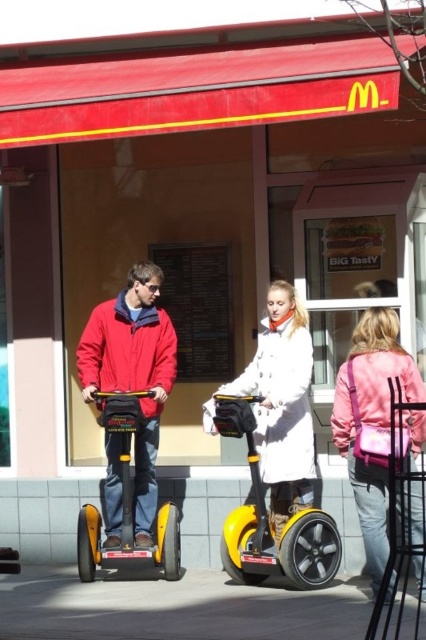
Question: Which point is farther to the camera?

Choices:
 (A) (92, 332)
 (B) (310, 355)

Answer: (A)

Question: Which of the following is the closest to the observer?

Choices:
 (A) (282, 472)
 (B) (319, 518)
 (C) (143, 362)

Answer: (B)

Question: Can you confirm if matte red jacket at center is smaller than yellow matte scooter at center?

Choices:
 (A) no
 (B) yes

Answer: (B)

Question: Does matte red jacket at center have a greater width compared to white fuzzy coat at center?

Choices:
 (A) no
 (B) yes

Answer: (B)

Question: Which point is farther from the camera taking this photo?

Choices:
 (A) coord(111,518)
 (B) coord(111,404)
 (C) coord(276,563)
 (D) coord(278,515)

Answer: (A)

Question: Is matte red jacket at center bigger than yellow matte scooter at center?

Choices:
 (A) yes
 (B) no

Answer: (B)